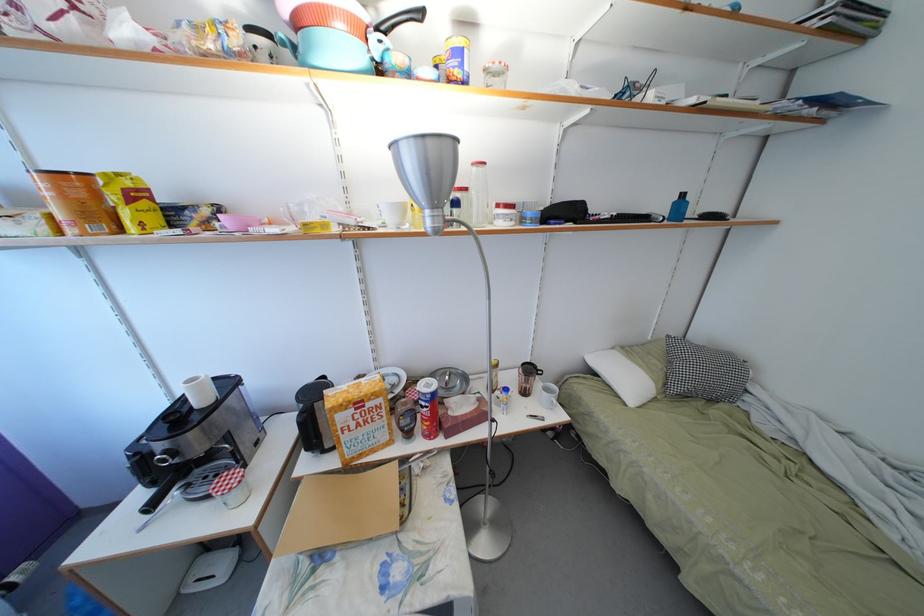
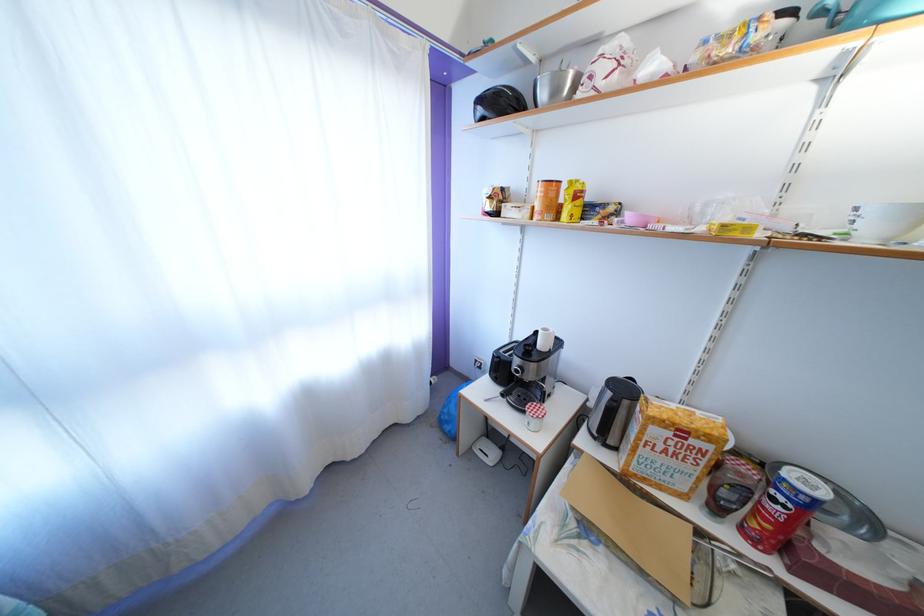
The point at [157,514] is marked in the first image. Where is the corresponding point in the second image?

(507, 400)